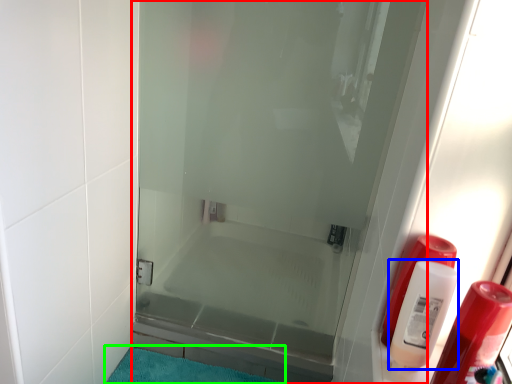
Question: Which object is the closest to the door (highlighted by a red box)? Choose among these: cleaning product (highlighted by a blue box) or bath mat (highlighted by a green box).

Choices:
 (A) cleaning product
 (B) bath mat

Answer: (B)